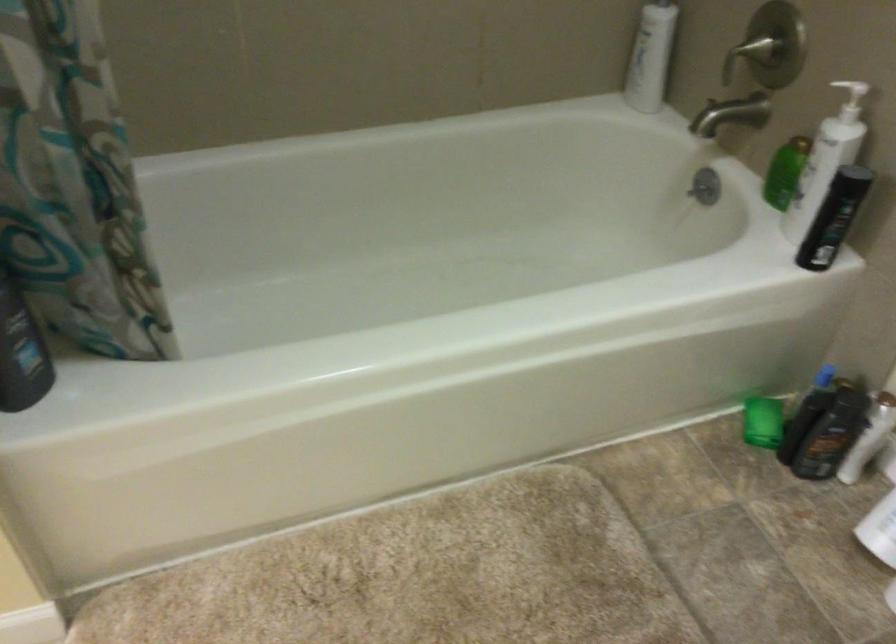
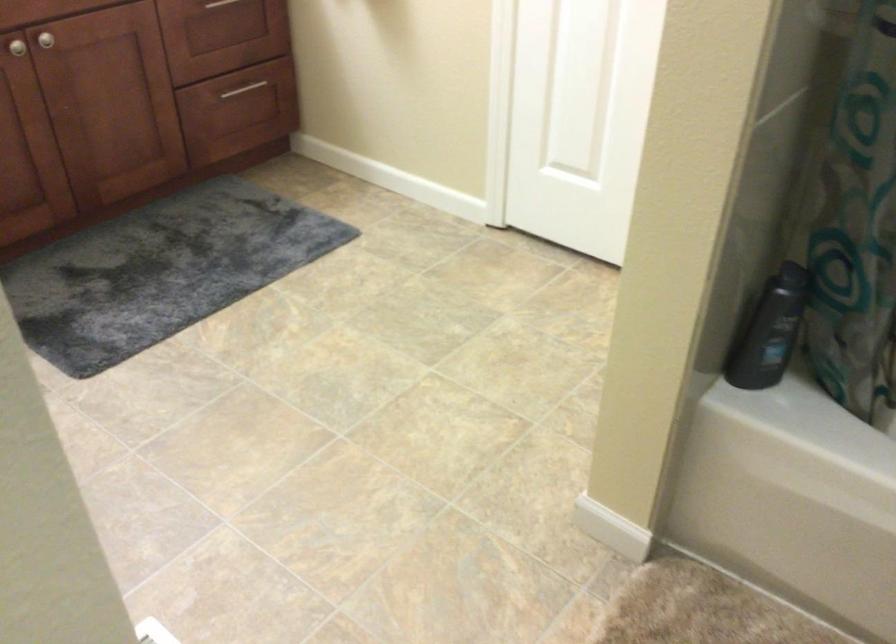
Question: The images are taken continuously from a first-person perspective. In which direction is your viewpoint rotating?

Choices:
 (A) Left
 (B) Right
 (C) Up
 (D) Down

Answer: (A)